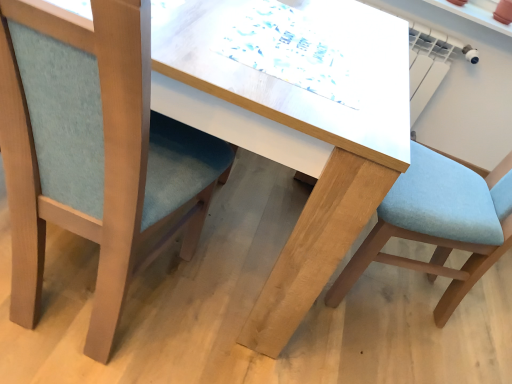
Question: Visually, is light blue fabric chair at left, acting as the first chair starting from the left, positioned to the left or to the right of light blue fabric chair at right, arranged as the 1th chair when viewed from the right?

Choices:
 (A) right
 (B) left

Answer: (B)

Question: Is light blue fabric chair at left, placed as the 2th chair when sorted from right to left, wider or thinner than light blue fabric chair at right, which is the second chair from left to right?

Choices:
 (A) thin
 (B) wide

Answer: (A)

Question: From a real-world perspective, is light blue fabric chair at left, acting as the first chair starting from the left, positioned above or below light blue fabric chair at right, which is the second chair from left to right?

Choices:
 (A) above
 (B) below

Answer: (B)

Question: From a real-world perspective, is light blue fabric chair at right, which is the second chair from left to right, positioned above or below light blue fabric chair at left, acting as the first chair starting from the left?

Choices:
 (A) above
 (B) below

Answer: (A)

Question: Based on their sizes in the image, would you say light blue fabric chair at right, which is the second chair from left to right, is bigger or smaller than light blue fabric chair at left, placed as the 2th chair when sorted from right to left?

Choices:
 (A) big
 (B) small

Answer: (A)

Question: Considering the positions of light blue fabric chair at right, which is the second chair from left to right, and light blue fabric chair at left, acting as the first chair starting from the left, in the image, is light blue fabric chair at right, which is the second chair from left to right, taller or shorter than light blue fabric chair at left, acting as the first chair starting from the left,?

Choices:
 (A) tall
 (B) short

Answer: (A)

Question: Considering their positions, is light blue fabric chair at right, arranged as the 1th chair when viewed from the right, located in front of or behind light blue fabric chair at left, placed as the 2th chair when sorted from right to left?

Choices:
 (A) front
 (B) behind

Answer: (B)